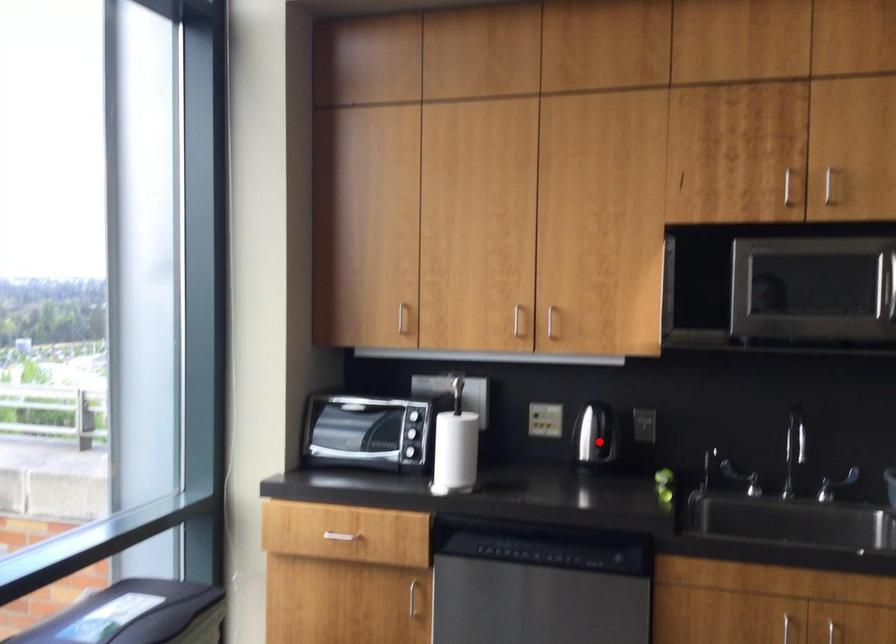
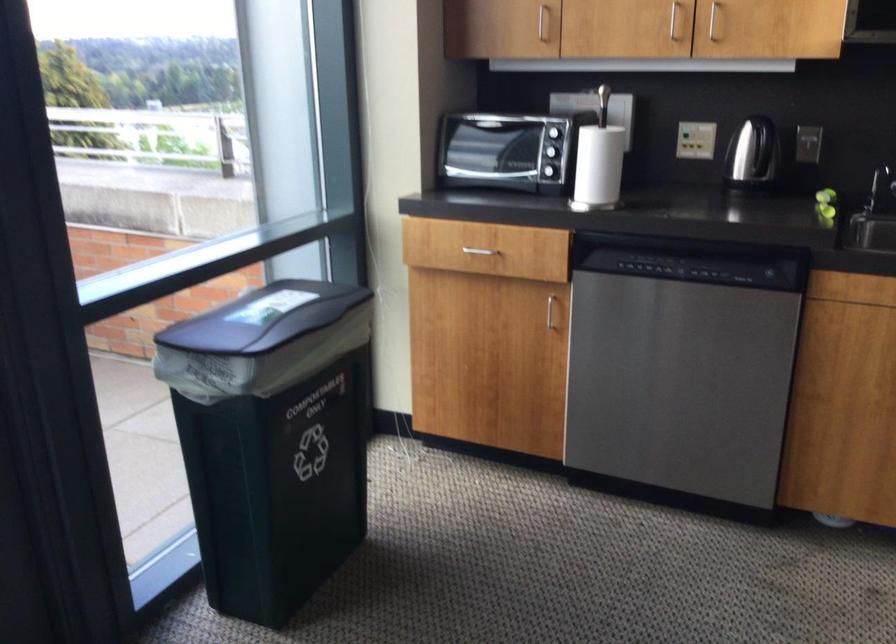
The point at the highlighted location is marked in the first image. Where is the corresponding point in the second image?

(752, 152)